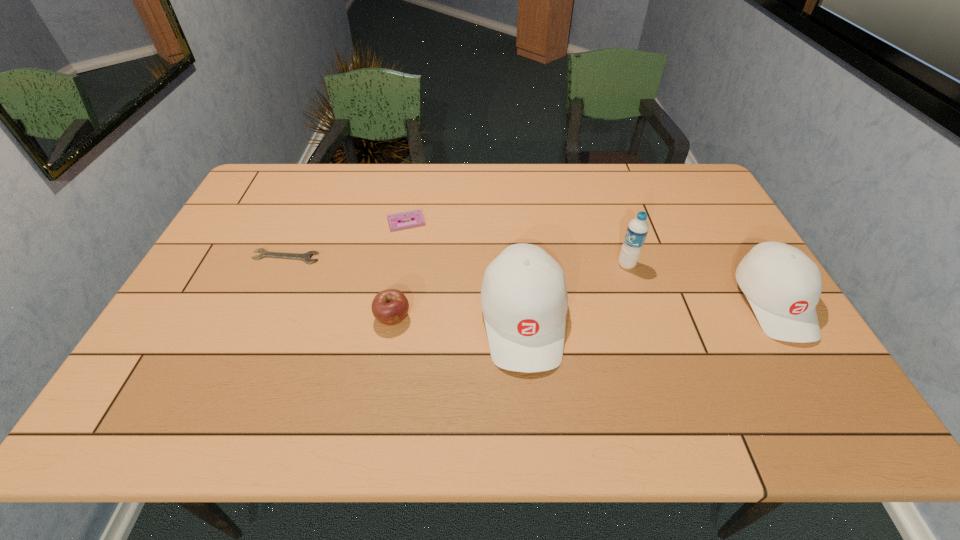
In the current image, all baseball caps are evenly spaced. To maintain this equal spacing, where should an additional baseball cap be placed on the left? Please point out a free spot. Please provide its 2D coordinates. Your answer should be formatted as a tuple, i.e. [(x, y)], where the tuple contains the x and y coordinates of a point satisfying the conditions above.

[(255, 338)]